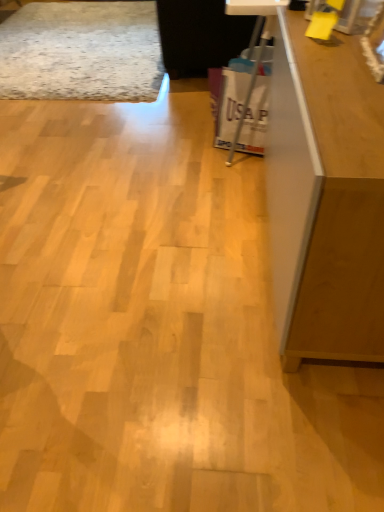
At what (x,y) coordinates should I click in order to perform the action: click on free location to the left of matte brown cabinet at right. Please return your answer as a coordinate pair (x, y). The height and width of the screenshot is (512, 384). Looking at the image, I should click on (151, 265).